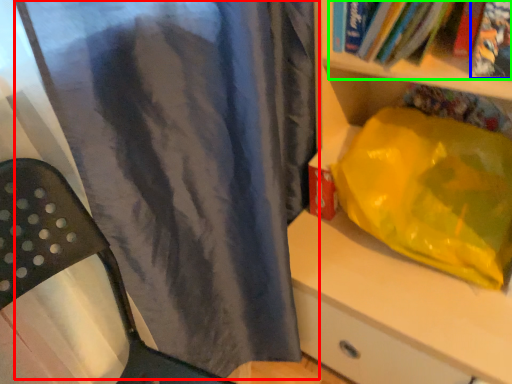
Question: Considering the real-world distances, which object is farthest from curtain (highlighted by a red box)? book (highlighted by a blue box) or book (highlighted by a green box)?

Choices:
 (A) book
 (B) book

Answer: (A)